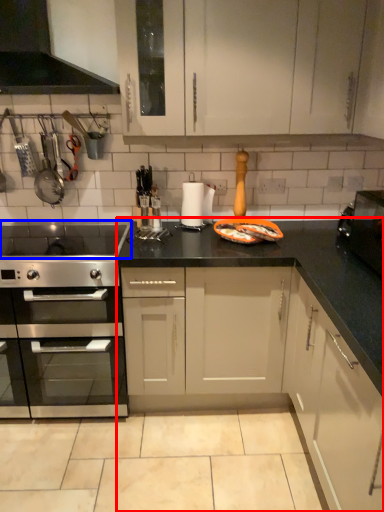
Question: Which point is closer to the camera, cabinetry (highlighted by a red box) or gas stove (highlighted by a blue box)?

Choices:
 (A) cabinetry
 (B) gas stove

Answer: (B)